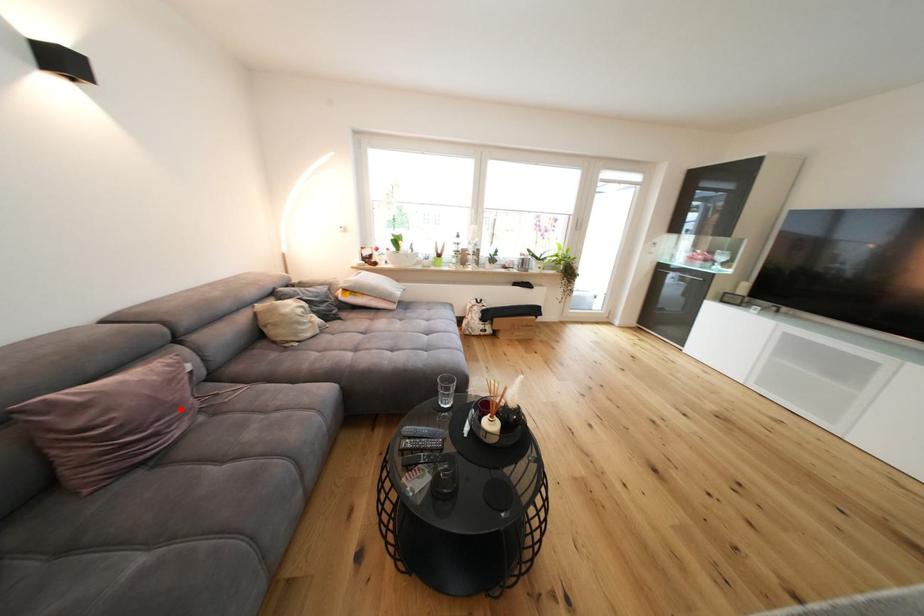
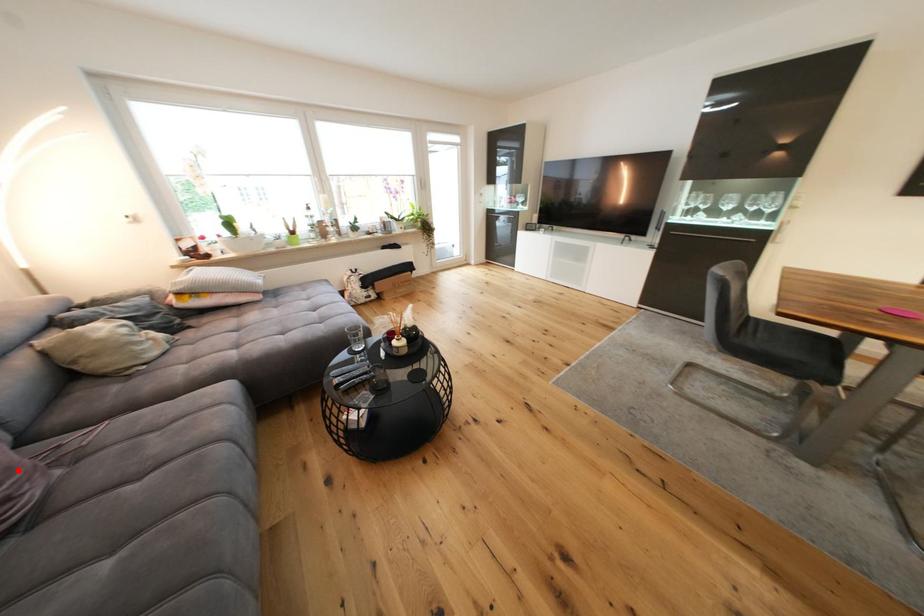
I am providing you with two images of the same scene from different viewpoints. A red point is marked on the first image and another point is marked on the second image. Are the points marked in image1 and image2 representing the same 3D position?

Yes